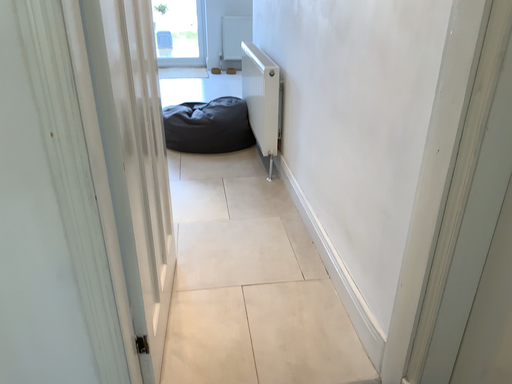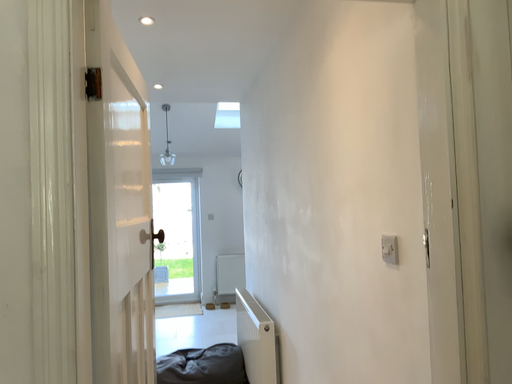
Question: Which way did the camera rotate in the video?

Choices:
 (A) rotated upward
 (B) rotated downward

Answer: (A)